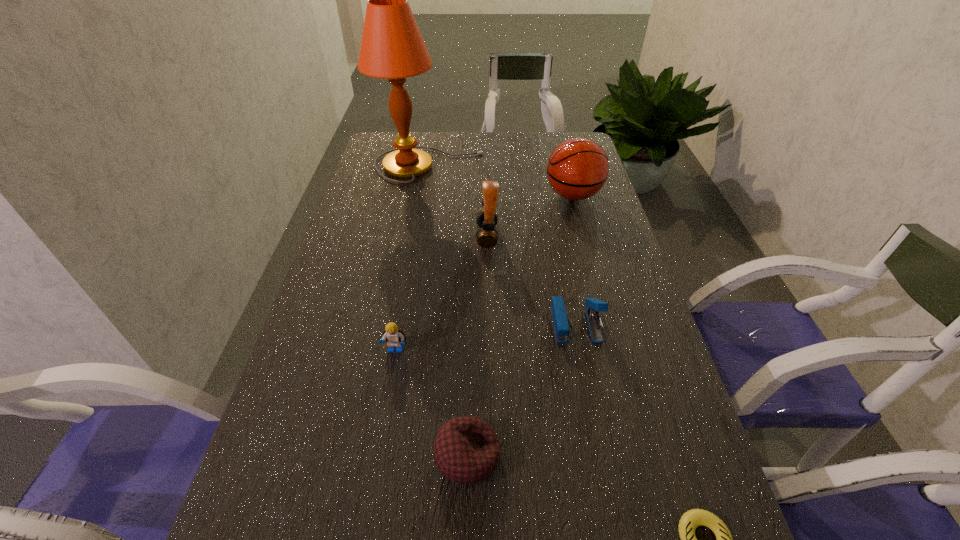
At what (x,y) coordinates should I click in order to perform the action: click on free space located on the side with spill of the basketball. Please return your answer as a coordinate pair (x, y). This screenshot has width=960, height=540. Looking at the image, I should click on (497, 195).

Locate an element on the screen. The width and height of the screenshot is (960, 540). vacant area situated on the ear cups of the headset is located at coordinates (373, 237).

Where is `free space located on the ear cups of the headset`? This screenshot has height=540, width=960. free space located on the ear cups of the headset is located at coordinates (346, 237).

Image resolution: width=960 pixels, height=540 pixels. Find the location of `vacant space located on the ear cups of the headset`. vacant space located on the ear cups of the headset is located at coordinates (339, 237).

Locate an element on the screen. The height and width of the screenshot is (540, 960). vacant space located on the back of the stapler is located at coordinates (563, 257).

The image size is (960, 540). I want to click on vacant space situated on the front-facing side of the Lego, so click(x=368, y=516).

Find the location of a particular element. This screenshot has height=540, width=960. blank space located on the left of the sixth tallest object is located at coordinates (381, 456).

Locate an element on the screen. This screenshot has width=960, height=540. object at the far edge is located at coordinates (392, 47).

Identify the location of object that is at the left edge. The height and width of the screenshot is (540, 960). (392, 47).

Identify the location of basketball located in the right edge section of the desktop. The image size is (960, 540). (577, 169).